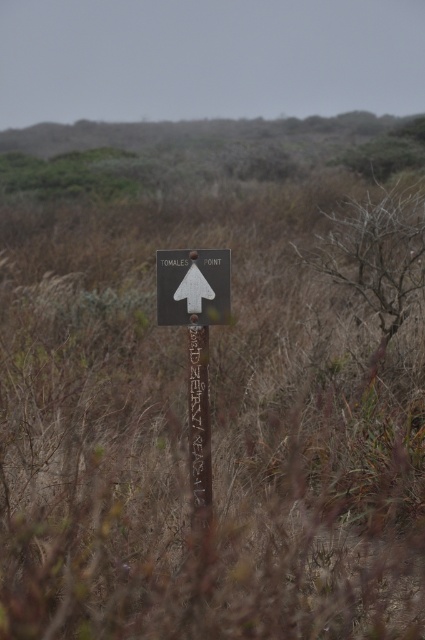
You are standing in front of the metallic gray signpost at center and want to touch the metallic sign at center. Can you reach it without moving your position?

The metallic gray signpost at center is closer to the viewer than the metallic sign at center, so you can reach the metallic sign at center without moving your position because it is closer.

You are hiking and come across the wooden signpost at center and the white matte arrow at center. According to the sign, which direction should you head towards to reach Tomales Point?

The white matte arrow at center points upwards, indicating the direction towards Tomales Point. Since the wooden signpost at center is located below the arrow, you should follow the direction the arrow is pointing to reach Tomales Point.